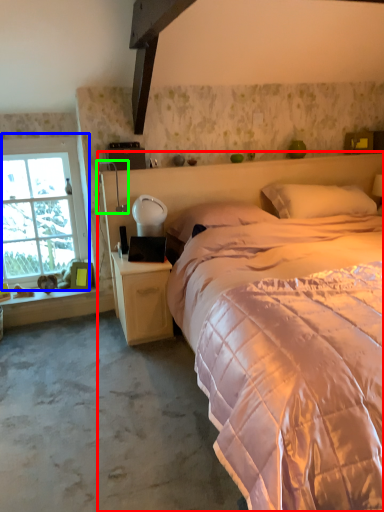
Question: Which object is positioned closest to bed (highlighted by a red box)? Select from window (highlighted by a blue box) and table lamp (highlighted by a green box).

Choices:
 (A) window
 (B) table lamp

Answer: (B)